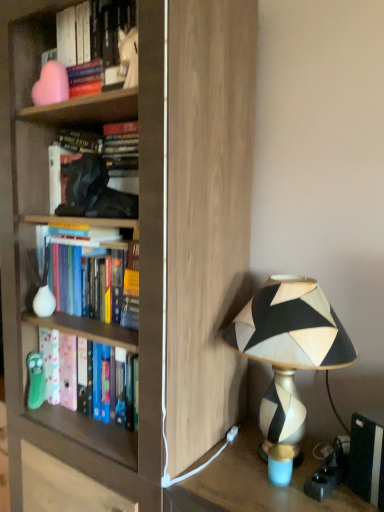
Question: Would you say matte wood bookcase at center is outside geometric-patterned lampshade at right?

Choices:
 (A) yes
 (B) no

Answer: (A)

Question: Can you confirm if matte wood bookcase at center is shorter than geometric-patterned lampshade at right?

Choices:
 (A) yes
 (B) no

Answer: (B)

Question: Does matte wood bookcase at center turn towards geometric-patterned lampshade at right?

Choices:
 (A) no
 (B) yes

Answer: (A)

Question: From the image's perspective, is matte wood bookcase at center below geometric-patterned lampshade at right?

Choices:
 (A) yes
 (B) no

Answer: (B)

Question: From a real-world perspective, is matte wood bookcase at center physically above geometric-patterned lampshade at right?

Choices:
 (A) yes
 (B) no

Answer: (A)

Question: Does point (317, 338) appear closer or farther from the camera than point (110, 210)?

Choices:
 (A) closer
 (B) farther

Answer: (A)

Question: From a real-world perspective, relative to hardcover book at center, the 3th book in the bottom-to-top sequence, is geometric-patterned lampshade at right vertically above or below?

Choices:
 (A) below
 (B) above

Answer: (A)

Question: Is geometric-patterned lampshade at right in front of or behind hardcover book at center, the 3th book in the bottom-to-top sequence, in the image?

Choices:
 (A) front
 (B) behind

Answer: (A)

Question: Based on their sizes in the image, would you say geometric-patterned lampshade at right is bigger or smaller than hardcover book at center, the 2th book from the top?

Choices:
 (A) big
 (B) small

Answer: (A)

Question: Looking at the image, does matte wood bookcase at center seem bigger or smaller compared to pink matte vase at upper left, which appears as the 4th book when ordered from the bottom?

Choices:
 (A) small
 (B) big

Answer: (B)

Question: Does point (208, 260) appear closer or farther from the camera than point (94, 55)?

Choices:
 (A) farther
 (B) closer

Answer: (B)

Question: Choose the correct answer: Is matte wood bookcase at center inside pink matte vase at upper left, marked as the first book in a top-to-bottom arrangement, or outside it?

Choices:
 (A) inside
 (B) outside

Answer: (B)

Question: In terms of width, does matte wood bookcase at center look wider or thinner when compared to pink matte vase at upper left, which appears as the 4th book when ordered from the bottom?

Choices:
 (A) thin
 (B) wide

Answer: (B)

Question: Looking at their shapes, would you say matte wood bookcase at center is wider or thinner than black matte book at lower right?

Choices:
 (A) thin
 (B) wide

Answer: (B)

Question: From the image's perspective, is matte wood bookcase at center above or below black matte book at lower right?

Choices:
 (A) below
 (B) above

Answer: (B)